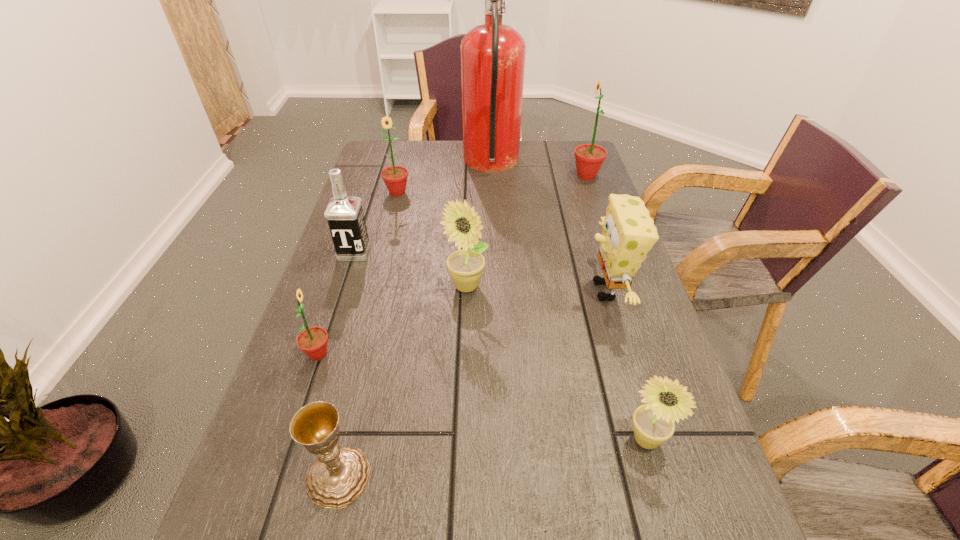
Identify the location of vacant area situated on the face of the biggest green sunflower. This screenshot has height=540, width=960. (537, 176).

Where is `free space located 0.310m on the face of the second farthest sunflower`? This screenshot has height=540, width=960. free space located 0.310m on the face of the second farthest sunflower is located at coordinates pyautogui.click(x=377, y=270).

Locate an element on the screen. The height and width of the screenshot is (540, 960). vacant space located 0.280m on the face of the third farthest sunflower is located at coordinates (462, 413).

Locate an element on the screen. vacant area situated 0.290m on the front label of the vodka is located at coordinates (321, 356).

This screenshot has width=960, height=540. I want to click on vacant space situated 0.290m on the face of the yellow sponge, so click(458, 291).

Locate an element on the screen. free region located on the face of the yellow sponge is located at coordinates (432, 291).

You are a GUI agent. You are given a task and a screenshot of the screen. Output one action in this format:
    pyautogui.click(x=<x>, y=<y>)
    Task: Click on the free space located on the face of the yellow sponge
    This screenshot has width=960, height=540.
    Given the screenshot: What is the action you would take?
    pyautogui.click(x=436, y=291)

Find the location of a particular element. This screenshot has height=540, width=960. free space located 0.220m on the face of the fourth farthest sunflower is located at coordinates (443, 354).

Where is `blank area located 0.090m on the face of the nearest sunflower`? The image size is (960, 540). blank area located 0.090m on the face of the nearest sunflower is located at coordinates (667, 517).

Identify the location of vacant space located on the right of the chalice. Image resolution: width=960 pixels, height=540 pixels. pyautogui.click(x=457, y=477).